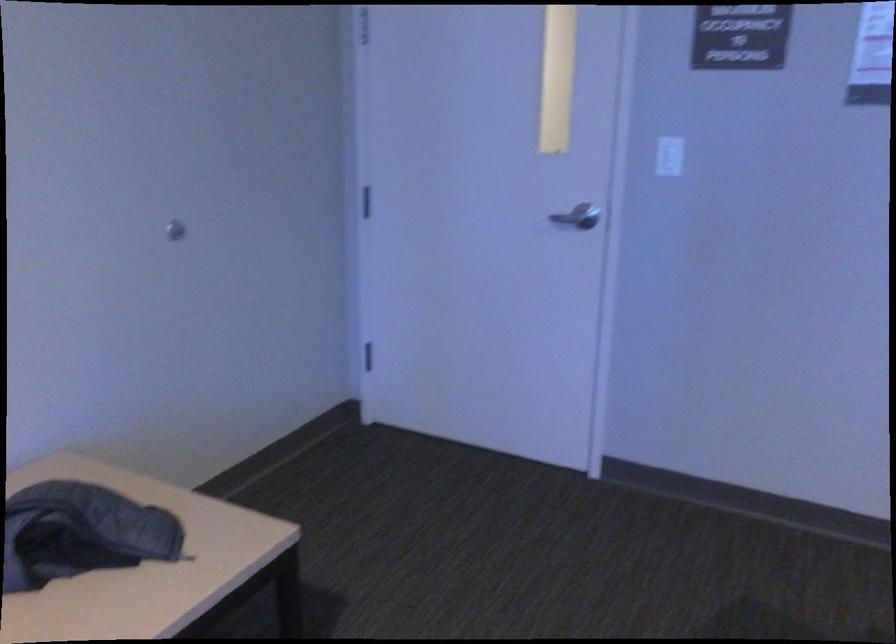
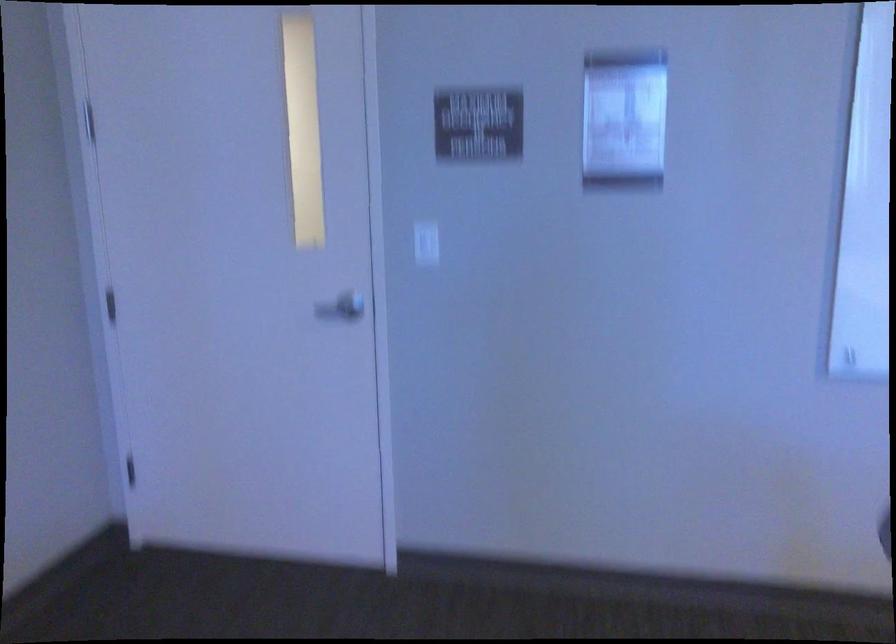
In the second image, find the point that corresponds to point (668, 158) in the first image.

(426, 243)